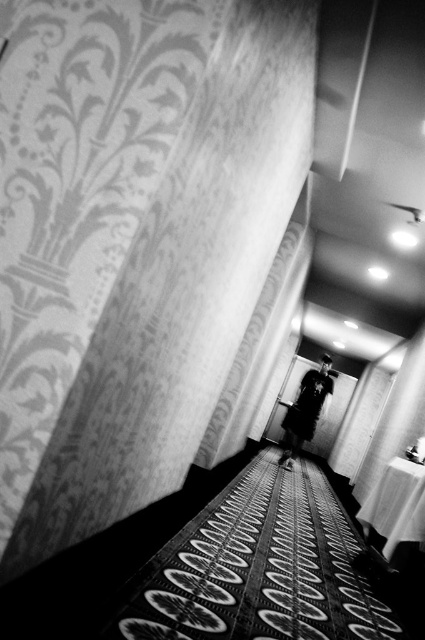
You are standing in the room and want to see the dark fabric coat at center. Is the silky white curtain at center blocking your view of it?

The silky white curtain at center is in front of the dark fabric coat at center, so yes, the silky white curtain at center is blocking your view of the dark fabric coat at center.